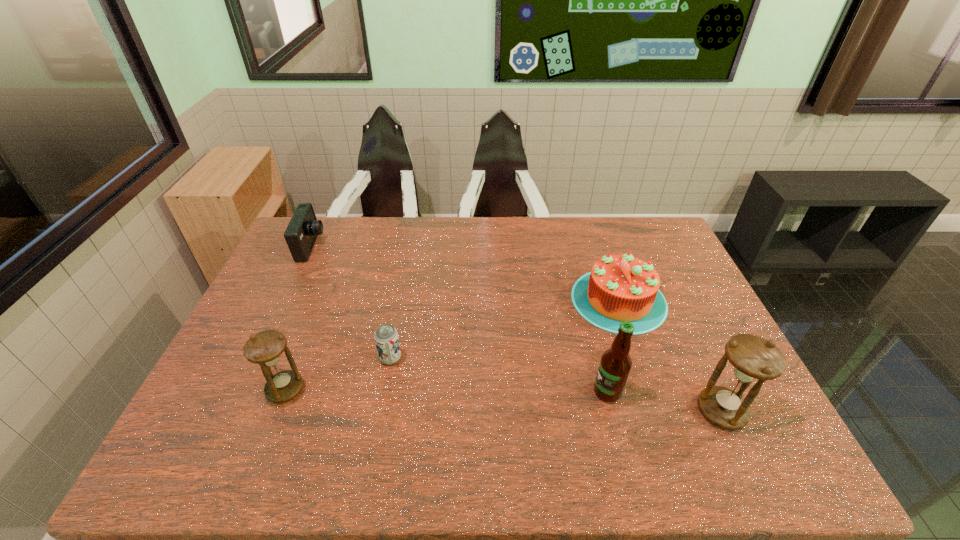
Image resolution: width=960 pixels, height=540 pixels. Find the location of `camera situated at the left edge`. camera situated at the left edge is located at coordinates pos(301,233).

Where is `hourglass that is at the right edge`? This screenshot has height=540, width=960. hourglass that is at the right edge is located at coordinates (753, 358).

What are the coordinates of `cake that is positioned at the right edge` in the screenshot? It's located at tap(619, 288).

Where is `object at the far left corner`? The width and height of the screenshot is (960, 540). object at the far left corner is located at coordinates (301, 233).

At what (x,y) coordinates should I click in order to perform the action: click on object that is at the near left corner. Please return your answer as a coordinate pair (x, y). This screenshot has height=540, width=960. Looking at the image, I should click on coord(265,348).

This screenshot has height=540, width=960. Find the location of `object that is at the near right corner`. object that is at the near right corner is located at coordinates (753, 358).

Image resolution: width=960 pixels, height=540 pixels. In the image, there is a desktop. Find the location of `vacant area at the far edge`. vacant area at the far edge is located at coordinates (420, 251).

Locate an element on the screen. This screenshot has width=960, height=540. vacant region at the near edge of the desktop is located at coordinates (267, 417).

This screenshot has width=960, height=540. Find the location of `blank area at the left edge`. blank area at the left edge is located at coordinates (307, 297).

In the image, there is a desktop. Identify the location of vacant space at the right edge. This screenshot has height=540, width=960. (695, 286).